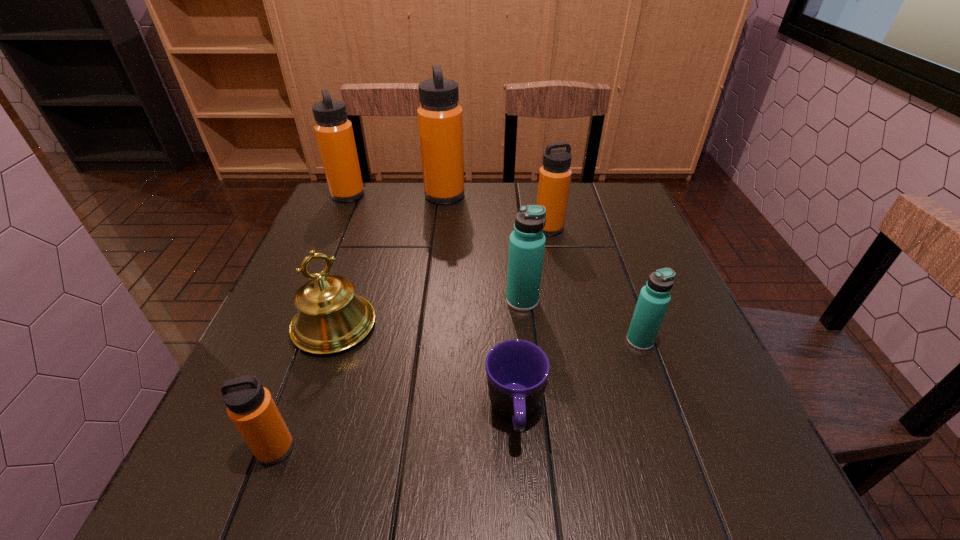
The image size is (960, 540). What are the coordinates of `empty space between the black mug and the nearest thermos bottle` in the screenshot? It's located at (395, 430).

Where is `free space that is in between the mug and the smallest orange thermos bottle`? The width and height of the screenshot is (960, 540). free space that is in between the mug and the smallest orange thermos bottle is located at coordinates (x=395, y=430).

Where is `free point between the black mug and the third thermos bottle from left to right`? The height and width of the screenshot is (540, 960). free point between the black mug and the third thermos bottle from left to right is located at coordinates (480, 304).

Image resolution: width=960 pixels, height=540 pixels. I want to click on object that is the fifth closest to the third smallest orange thermos bottle, so click(x=517, y=370).

Select which object is the fifth closest to the tallest object. Please provide its 2D coordinates. Your answer should be formatted as a tuple, i.e. [(x, y)], where the tuple contains the x and y coordinates of a point satisfying the conditions above.

[(654, 298)]

The height and width of the screenshot is (540, 960). Find the location of `the closest thermos bottle relative to the gold bell`. the closest thermos bottle relative to the gold bell is located at coordinates (250, 406).

The height and width of the screenshot is (540, 960). I want to click on thermos bottle that is the fifth closest one to the gold bell, so click(555, 174).

Choose which orange thermos bottle is the second nearest neighbor to the fifth shortest thermos bottle. Please provide its 2D coordinates. Your answer should be formatted as a tuple, i.e. [(x, y)], where the tuple contains the x and y coordinates of a point satisfying the conditions above.

[(555, 174)]

Identify which orange thermos bottle is located as the nearest to the nearest thermos bottle. Please provide its 2D coordinates. Your answer should be formatted as a tuple, i.e. [(x, y)], where the tuple contains the x and y coordinates of a point satisfying the conditions above.

[(555, 174)]

Image resolution: width=960 pixels, height=540 pixels. In order to click on blank space that satisfies the following two spatial constraints: 1. on the back side of the second nearest orange thermos bottle; 2. on the right side of the nearest thermos bottle in this screenshot , I will do `click(356, 228)`.